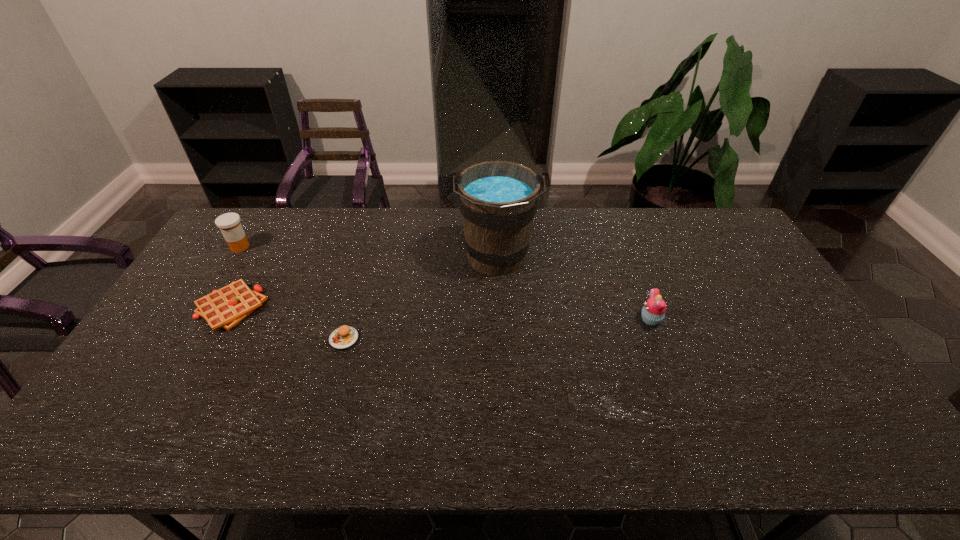
The height and width of the screenshot is (540, 960). I want to click on the fourth object from left to right, so click(x=497, y=199).

The width and height of the screenshot is (960, 540). I want to click on wine bucket, so click(x=497, y=199).

Identify the location of medicine. (229, 223).

Find the location of a particular element. This screenshot has width=960, height=540. cupcake is located at coordinates (653, 312).

Find the location of `the rightmost object`. the rightmost object is located at coordinates (653, 312).

Locate an element on the screen. The height and width of the screenshot is (540, 960). waffle is located at coordinates (227, 307).

This screenshot has height=540, width=960. I want to click on the third object from left to right, so 344,337.

Where is `vacant area situated 0.170m with a handle on the side of the tallest object`? vacant area situated 0.170m with a handle on the side of the tallest object is located at coordinates (x=499, y=331).

At what (x,y) coordinates should I click in order to perform the action: click on vacant space situated 0.250m on the label of the medicine. Please return your answer as a coordinate pair (x, y). Looking at the image, I should click on (202, 307).

Find the location of a particular element. The width and height of the screenshot is (960, 540). free space located on the face of the third tallest object is located at coordinates (598, 320).